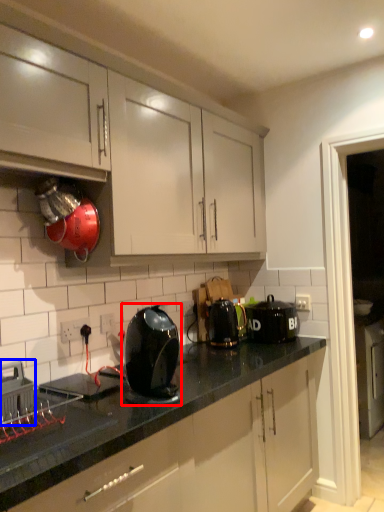
Question: Which object appears farthest to the camera in this image, kitchen appliance (highlighted by a red box) or home appliance (highlighted by a blue box)?

Choices:
 (A) kitchen appliance
 (B) home appliance

Answer: (A)